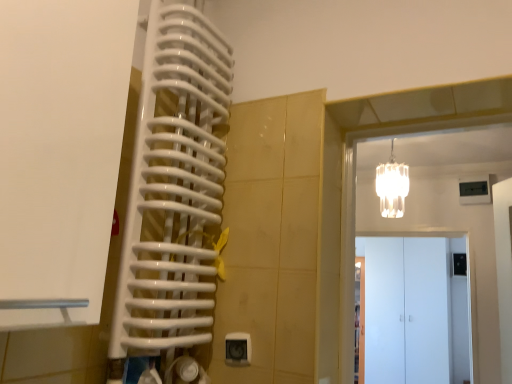
Question: From the image's perspective, is white matte door at left, the 3th door viewed from the right, positioned above or below white glossy door at right, which is counted as the first door, starting from the bottom?

Choices:
 (A) below
 (B) above

Answer: (B)

Question: In terms of height, does white matte door at left, the 3th door viewed from the right, look taller or shorter compared to white glossy door at right, the third door from the front?

Choices:
 (A) tall
 (B) short

Answer: (B)

Question: Which is farther from the white matte cabinet at center, acting as the second door starting from the right?

Choices:
 (A) white glossy door at right, the third door in the left-to-right sequence
 (B) white matte door at left, which appears as the third door when viewed from the back
 (C) white glass chandelier at upper right

Answer: (B)

Question: Considering the real-world distances, which object is farthest from the white glass chandelier at upper right?

Choices:
 (A) white glossy door at right, which is counted as the first door, starting from the bottom
 (B) white matte door at left, placed as the 1th door when sorted from left to right
 (C) white matte cabinet at center, which ranks as the 2th door in top-to-bottom order

Answer: (B)